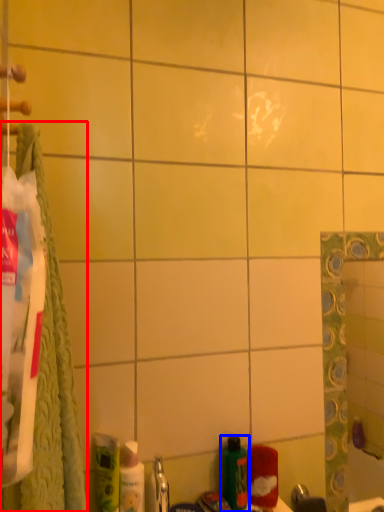
Question: Which of the following is the closest to the observer, bath towel (highlighted by a red box) or bottle (highlighted by a blue box)?

Choices:
 (A) bath towel
 (B) bottle

Answer: (A)